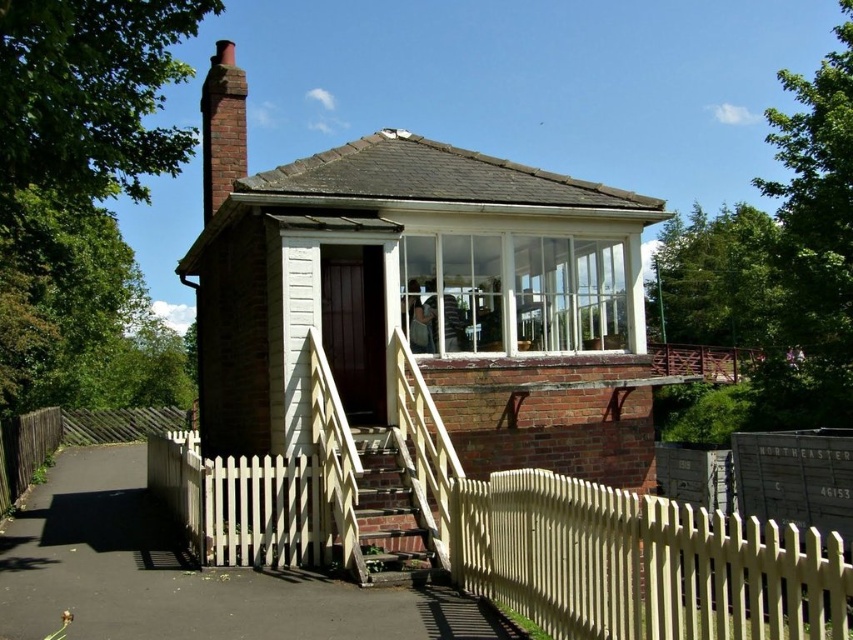
Can you confirm if white picket fence at lower right is positioned above brick chimney at upper left?

No, white picket fence at lower right is not above brick chimney at upper left.

Which is more to the left, white picket fence at lower right or brick chimney at upper left?

brick chimney at upper left is more to the left.

Between point (621, 595) and point (247, 92), which one is positioned behind?

The point (247, 92) is more distant.

At what (x,y) coordinates should I click in order to perform the action: click on white picket fence at lower right. Please return your answer as a coordinate pair (x, y). Looking at the image, I should click on (641, 563).

Which is below, white picket fence at lower center or brick chimney at upper left?

white picket fence at lower center is lower down.

Does white picket fence at lower center appear on the right side of brick chimney at upper left?

Correct, you'll find white picket fence at lower center to the right of brick chimney at upper left.

Is point (491, 536) farther from camera compared to point (227, 150)?

That is False.

Identify the location of white picket fence at lower center. The height and width of the screenshot is (640, 853). (642, 563).

Who is more forward, (604, 536) or (759, 560)?

Point (759, 560) is more forward.

Which is below, white picket fence at lower center or white picket fence at lower right?

white picket fence at lower center is lower down.

Locate an element on the screen. The image size is (853, 640). white picket fence at lower center is located at coordinates (642, 563).